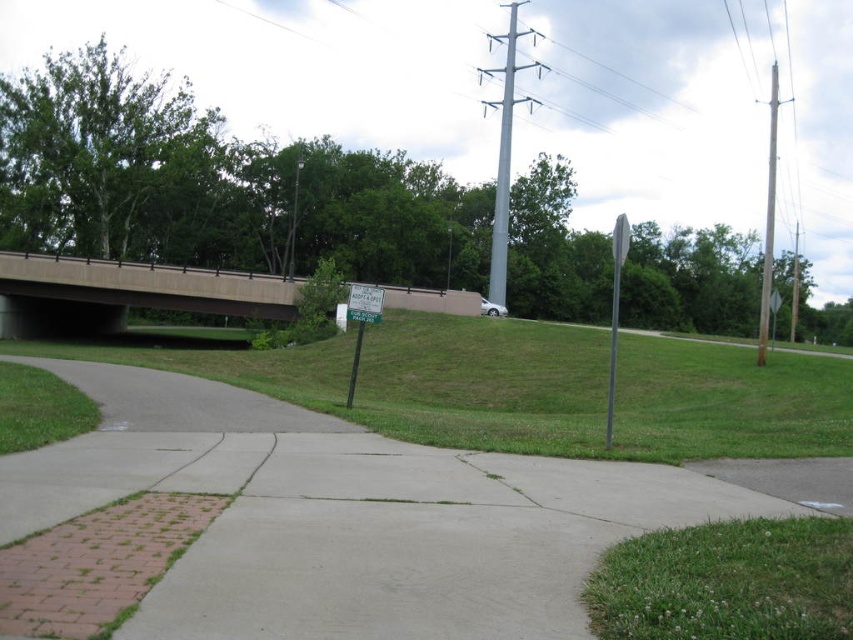
Question: Is the position of concrete bridge at upper center more distant than that of wooden utility pole at upper right?

Choices:
 (A) no
 (B) yes

Answer: (B)

Question: Which is nearer to the green plastic sign at center?

Choices:
 (A) green grass at lower right
 (B) wooden utility pole at upper right
 (C) concrete bridge at upper center
 (D) concrete at center

Answer: (D)

Question: Which object is farther from the camera taking this photo?

Choices:
 (A) metallic gray sign at right
 (B) wooden utility pole at upper right
 (C) green grassy at lower center

Answer: (B)

Question: Does concrete at center have a greater width compared to metallic gray sign at right?

Choices:
 (A) yes
 (B) no

Answer: (B)

Question: Is concrete bridge at upper center positioned in front of metallic gray sign at right?

Choices:
 (A) no
 (B) yes

Answer: (A)

Question: Which point appears farthest from the camera in this image?

Choices:
 (A) (352, 371)
 (B) (613, 275)
 (C) (761, 518)

Answer: (B)